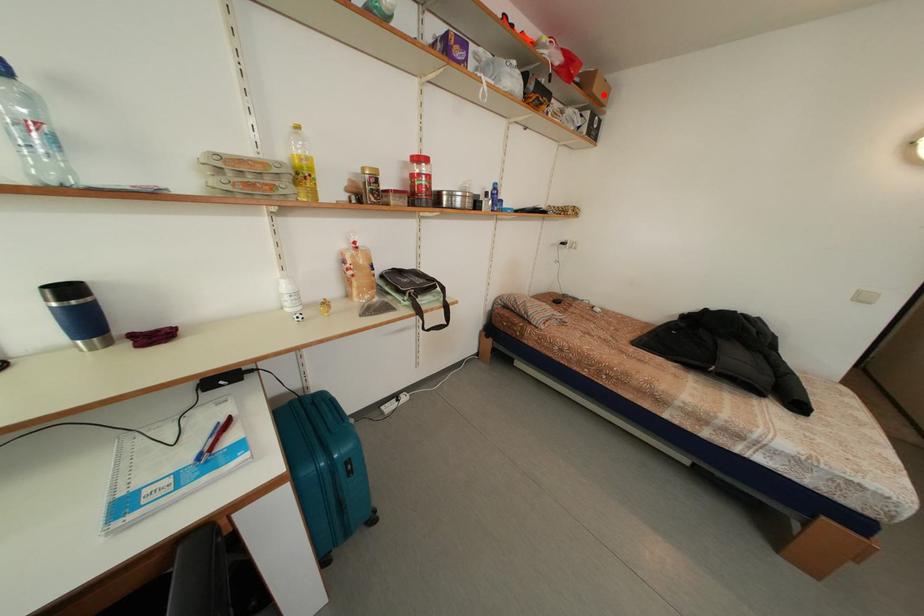
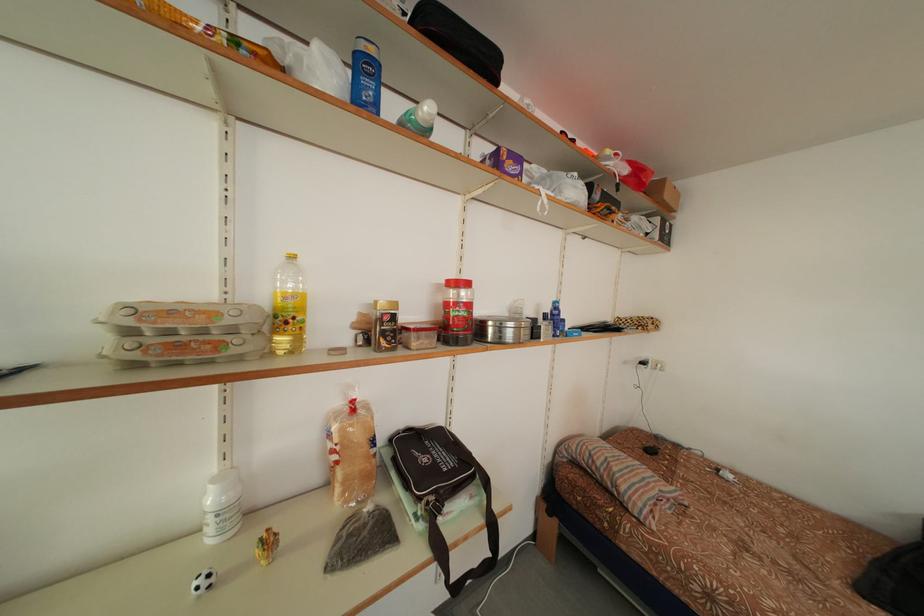
Question: I am providing you with two images of the same scene from different viewpoints. A red point is marked on the first image. At the location where the point appears in image 1, is it still visible in image 2?

Choices:
 (A) Yes
 (B) No

Answer: (A)